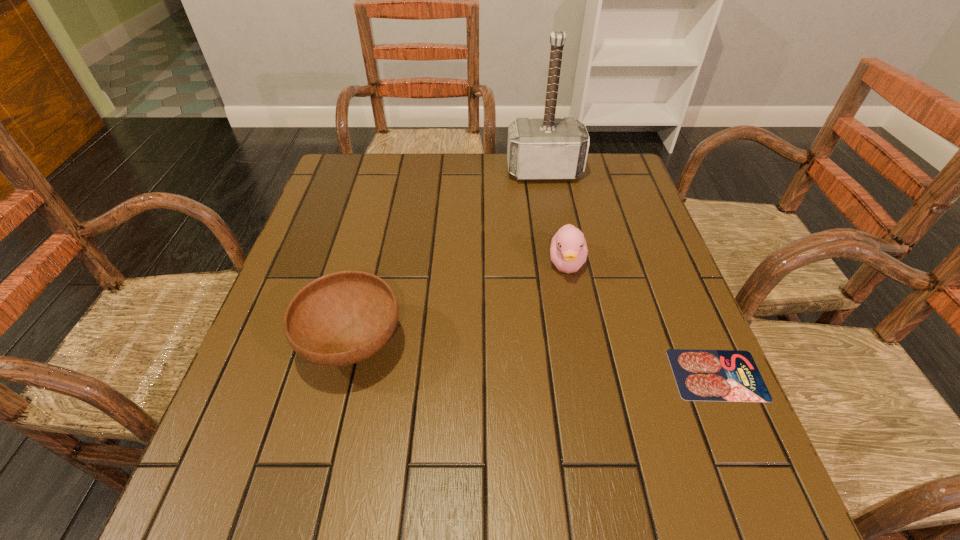
Where is `free area in between the leftmost object and the hammer`? The image size is (960, 540). free area in between the leftmost object and the hammer is located at coordinates (448, 258).

Where is `unoccupied area between the tallest object and the leftmost object`? This screenshot has width=960, height=540. unoccupied area between the tallest object and the leftmost object is located at coordinates (448, 258).

This screenshot has width=960, height=540. I want to click on vacant space that's between the hammer and the bowl, so click(448, 258).

This screenshot has width=960, height=540. I want to click on free spot between the second farthest object and the shortest object, so click(642, 319).

I want to click on vacant area that lies between the bowl and the shortest object, so click(x=535, y=360).

Where is `unoccupied area between the tallest object and the bowl`? The height and width of the screenshot is (540, 960). unoccupied area between the tallest object and the bowl is located at coordinates (448, 258).

The height and width of the screenshot is (540, 960). Identify the location of unoccupied position between the tallest object and the shortest object. (631, 273).

Where is `the third closest object relative to the bowl`? the third closest object relative to the bowl is located at coordinates (701, 375).

Identify which object is the third nearest to the leftmost object. Please provide its 2D coordinates. Your answer should be formatted as a tuple, i.e. [(x, y)], where the tuple contains the x and y coordinates of a point satisfying the conditions above.

[(701, 375)]

The image size is (960, 540). Identify the location of blank space that satisfies the following two spatial constraints: 1. on the front side of the leftmost object; 2. on the left side of the salami. (346, 374).